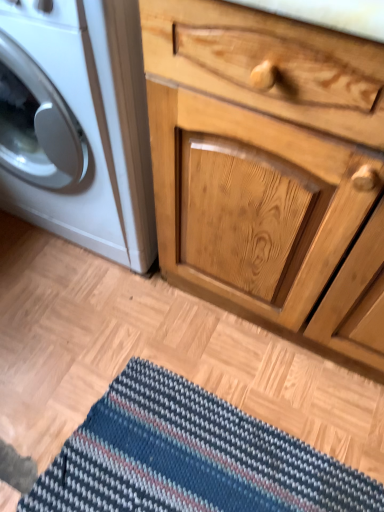
Question: Is the position of natural wood cabinet at center more distant than that of white glossy washing machine at left?

Choices:
 (A) yes
 (B) no

Answer: (B)

Question: Is natural wood cabinet at center looking in the opposite direction of white glossy washing machine at left?

Choices:
 (A) no
 (B) yes

Answer: (A)

Question: Is natural wood cabinet at center bigger than white glossy washing machine at left?

Choices:
 (A) yes
 (B) no

Answer: (A)

Question: From a real-world perspective, is natural wood cabinet at center physically below white glossy washing machine at left?

Choices:
 (A) yes
 (B) no

Answer: (B)

Question: From the image's perspective, is natural wood cabinet at center located beneath white glossy washing machine at left?

Choices:
 (A) no
 (B) yes

Answer: (B)

Question: Can you confirm if natural wood cabinet at center is shorter than white glossy washing machine at left?

Choices:
 (A) yes
 (B) no

Answer: (B)

Question: Could you tell me if white glossy washing machine at left is turned towards natural wood cabinet at center?

Choices:
 (A) yes
 (B) no

Answer: (B)

Question: From a real-world perspective, is white glossy washing machine at left located higher than natural wood cabinet at center?

Choices:
 (A) yes
 (B) no

Answer: (B)

Question: Considering the relative positions of white glossy washing machine at left and natural wood cabinet at center in the image provided, is white glossy washing machine at left in front of natural wood cabinet at center?

Choices:
 (A) yes
 (B) no

Answer: (B)

Question: From the image's perspective, would you say white glossy washing machine at left is positioned over natural wood cabinet at center?

Choices:
 (A) yes
 (B) no

Answer: (A)

Question: From the image's perspective, is white glossy washing machine at left under natural wood cabinet at center?

Choices:
 (A) no
 (B) yes

Answer: (A)

Question: Considering the relative sizes of white glossy washing machine at left and natural wood cabinet at center in the image provided, is white glossy washing machine at left bigger than natural wood cabinet at center?

Choices:
 (A) no
 (B) yes

Answer: (A)

Question: From the image's perspective, does striped fabric doormat at lower center appear higher than natural wood cabinet at center?

Choices:
 (A) no
 (B) yes

Answer: (A)